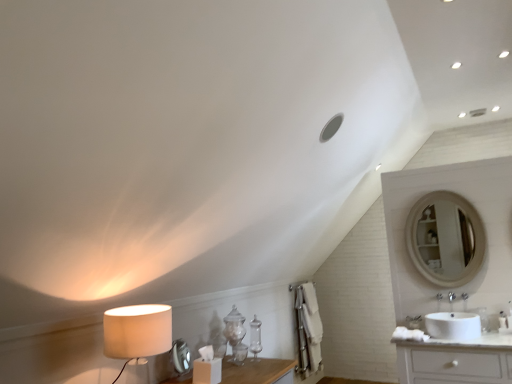
What do you see at coordinates (137, 333) in the screenshot? I see `beige fabric lampshade at left` at bounding box center [137, 333].

What is the approximate width of beige fabric lampshade at left?

beige fabric lampshade at left is 12.64 inches wide.

At what (x,y) coordinates should I click in order to perform the action: click on beige fabric lampshade at left. Please return your answer as a coordinate pair (x, y). Looking at the image, I should click on (137, 333).

Locate an element on the screen. The image size is (512, 384). white glossy sink at lower right is located at coordinates (x=453, y=325).

What do you see at coordinates (453, 325) in the screenshot?
I see `white glossy sink at lower right` at bounding box center [453, 325].

This screenshot has width=512, height=384. Find the location of `beige fabric lampshade at left`. beige fabric lampshade at left is located at coordinates (137, 333).

Visually, is beige fabric lampshade at left positioned to the left or to the right of white glossy sink at lower right?

In the image, beige fabric lampshade at left appears on the left side of white glossy sink at lower right.

Which is in front, beige fabric lampshade at left or white glossy sink at lower right?

beige fabric lampshade at left.

Consider the image. Which is closer to the camera, (138, 341) or (459, 321)?

Point (138, 341)

From the image's perspective, is beige fabric lampshade at left located beneath white glossy sink at lower right?

No, from the image's perspective, beige fabric lampshade at left is not below white glossy sink at lower right.

From a real-world perspective, is beige fabric lampshade at left below white glossy sink at lower right?

No.

Between beige fabric lampshade at left and white glossy sink at lower right, which one has larger width?

white glossy sink at lower right.

Which of these two, beige fabric lampshade at left or white glossy sink at lower right, stands taller?

beige fabric lampshade at left is taller.

Is beige fabric lampshade at left bigger than white glossy sink at lower right?

Correct, beige fabric lampshade at left is larger in size than white glossy sink at lower right.

Is beige fabric lampshade at left not inside white glossy sink at lower right?

That's correct, beige fabric lampshade at left is outside of white glossy sink at lower right.

Is beige fabric lampshade at left directly adjacent to white glossy sink at lower right?

beige fabric lampshade at left and white glossy sink at lower right are clearly separated.

Is beige fabric lampshade at left turned away from white glossy sink at lower right?

beige fabric lampshade at left is not turned away from white glossy sink at lower right.

How far apart are beige fabric lampshade at left and white glossy sink at lower right?

The distance of beige fabric lampshade at left from white glossy sink at lower right is 7.74 feet.

Find the location of a particular element. This screenshot has height=384, width=512. table lamp above the white glossy sink at lower right (from the image's perspective) is located at coordinates (137, 333).

Which object is positioned more to the right, white glossy sink at lower right or beige fabric lampshade at left?

Positioned to the right is white glossy sink at lower right.

Which is behind, white glossy sink at lower right or beige fabric lampshade at left?

white glossy sink at lower right is behind.

Is point (467, 316) positioned after point (112, 327)?

Yes, point (467, 316) is behind point (112, 327).

From the image's perspective, is white glossy sink at lower right above or below beige fabric lampshade at left?

Based on their image positions, white glossy sink at lower right is located beneath beige fabric lampshade at left.

From a real-world perspective, which object rests below the other?

white glossy sink at lower right, from a real-world perspective.

In the scene shown: Considering the sizes of white glossy sink at lower right and beige fabric lampshade at left in the image, is white glossy sink at lower right wider or thinner than beige fabric lampshade at left?

In the image, white glossy sink at lower right appears to be wider than beige fabric lampshade at left.

Who is taller, white glossy sink at lower right or beige fabric lampshade at left?

beige fabric lampshade at left.

Does white glossy sink at lower right have a larger size compared to beige fabric lampshade at left?

No.

Is beige fabric lampshade at left surrounded by white glossy sink at lower right?

No, beige fabric lampshade at left is not a part of white glossy sink at lower right.

Are white glossy sink at lower right and beige fabric lampshade at left located far from each other?

Yes, white glossy sink at lower right and beige fabric lampshade at left are quite far apart.

Could you tell me if white glossy sink at lower right is facing beige fabric lampshade at left?

No, white glossy sink at lower right is not oriented towards beige fabric lampshade at left.

Locate an element on the screen. The image size is (512, 384). sink lying below the beige fabric lampshade at left (from the image's perspective) is located at coordinates (453, 325).

You are a GUI agent. You are given a task and a screenshot of the screen. Output one action in this format:
    pyautogui.click(x=<x>, y=<y>)
    Task: Click on the table lamp in front of the white glossy sink at lower right
    This screenshot has width=512, height=384.
    Given the screenshot: What is the action you would take?
    pyautogui.click(x=137, y=333)

At what (x,y) coordinates should I click in order to perform the action: click on sink that appears behind the beige fabric lampshade at left. Please return your answer as a coordinate pair (x, y). This screenshot has width=512, height=384. Looking at the image, I should click on (453, 325).